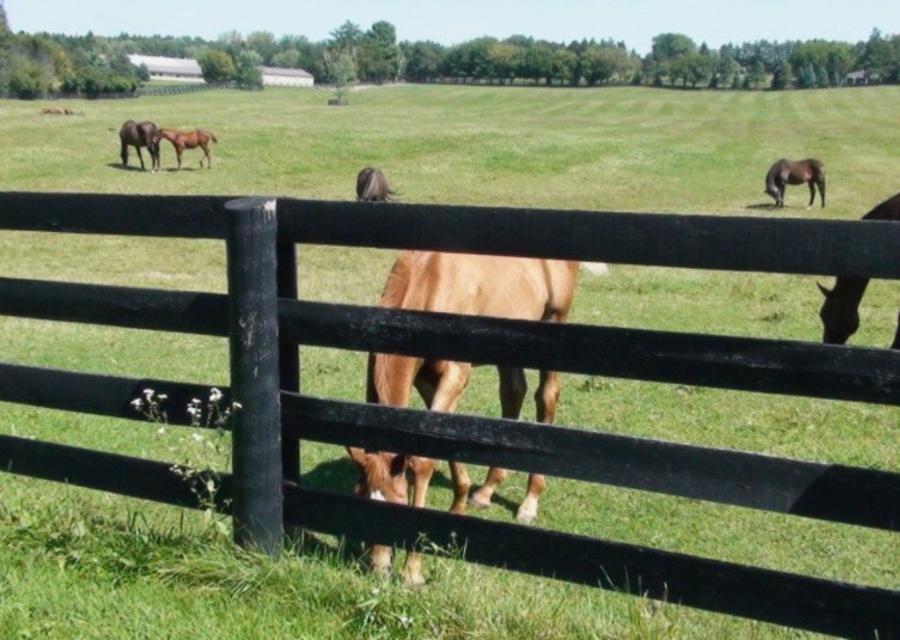
Question: Does brown glossy horse at center come behind brown glossy horse at right?

Choices:
 (A) no
 (B) yes

Answer: (A)

Question: Is light brown horse at center positioned before brown glossy horse at upper center?

Choices:
 (A) yes
 (B) no

Answer: (B)

Question: Which of the following is the farthest from the observer?

Choices:
 (A) (389, 204)
 (B) (482, 269)

Answer: (B)

Question: Which of the following is the farthest from the observer?

Choices:
 (A) (810, 163)
 (B) (428, 481)

Answer: (A)

Question: Which point is farther to the camera?

Choices:
 (A) brown glossy horse at right
 (B) brown glossy horse at upper left

Answer: (B)

Question: Does light brown horse at center appear on the right side of brown glossy horse at upper center?

Choices:
 (A) no
 (B) yes

Answer: (A)